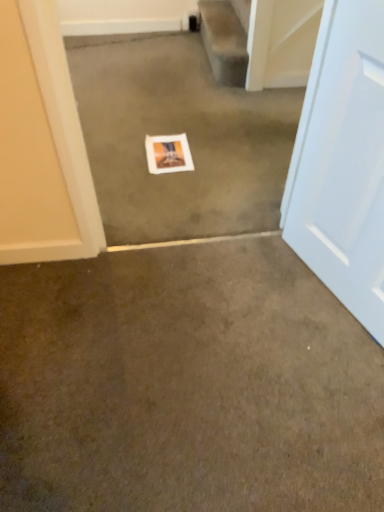
Question: Is smooth beige carpet at upper center bigger than white glossy door at right?

Choices:
 (A) yes
 (B) no

Answer: (B)

Question: Is smooth beige carpet at upper center aimed at white glossy door at right?

Choices:
 (A) no
 (B) yes

Answer: (A)

Question: Can you confirm if smooth beige carpet at upper center is taller than white glossy door at right?

Choices:
 (A) yes
 (B) no

Answer: (B)

Question: Considering the relative positions of smooth beige carpet at upper center and white glossy door at right in the image provided, is smooth beige carpet at upper center to the right of white glossy door at right from the viewer's perspective?

Choices:
 (A) no
 (B) yes

Answer: (A)

Question: Does smooth beige carpet at upper center have a smaller size compared to white glossy door at right?

Choices:
 (A) yes
 (B) no

Answer: (A)

Question: From the image's perspective, is white glossy door at right located above or below white paper at center, the 1th concrete when ordered from top to bottom?

Choices:
 (A) above
 (B) below

Answer: (B)

Question: Considering the positions of white glossy door at right and white paper at center, marked as the 2th concrete in a bottom-to-top arrangement, in the image, is white glossy door at right wider or thinner than white paper at center, marked as the 2th concrete in a bottom-to-top arrangement,?

Choices:
 (A) wide
 (B) thin

Answer: (B)

Question: Is white glossy door at right taller or shorter than white paper at center, the 1th concrete when ordered from top to bottom?

Choices:
 (A) short
 (B) tall

Answer: (B)

Question: Do you think white glossy door at right is within white paper at center, marked as the 2th concrete in a bottom-to-top arrangement, or outside of it?

Choices:
 (A) inside
 (B) outside

Answer: (B)

Question: Is point (216, 58) closer or farther from the camera than point (178, 136)?

Choices:
 (A) farther
 (B) closer

Answer: (A)

Question: From a real-world perspective, relative to white matte picture frame at center, is smooth beige carpet at upper center vertically above or below?

Choices:
 (A) below
 (B) above

Answer: (B)

Question: Would you say smooth beige carpet at upper center is inside or outside white matte picture frame at center?

Choices:
 (A) inside
 (B) outside

Answer: (B)

Question: Is smooth beige carpet at upper center taller or shorter than white matte picture frame at center?

Choices:
 (A) short
 (B) tall

Answer: (B)

Question: Does point (240, 131) appear closer or farther from the camera than point (165, 151)?

Choices:
 (A) farther
 (B) closer

Answer: (A)

Question: Is white paper at center, marked as the 2th concrete in a bottom-to-top arrangement, in front of or behind white matte picture frame at center in the image?

Choices:
 (A) front
 (B) behind

Answer: (A)